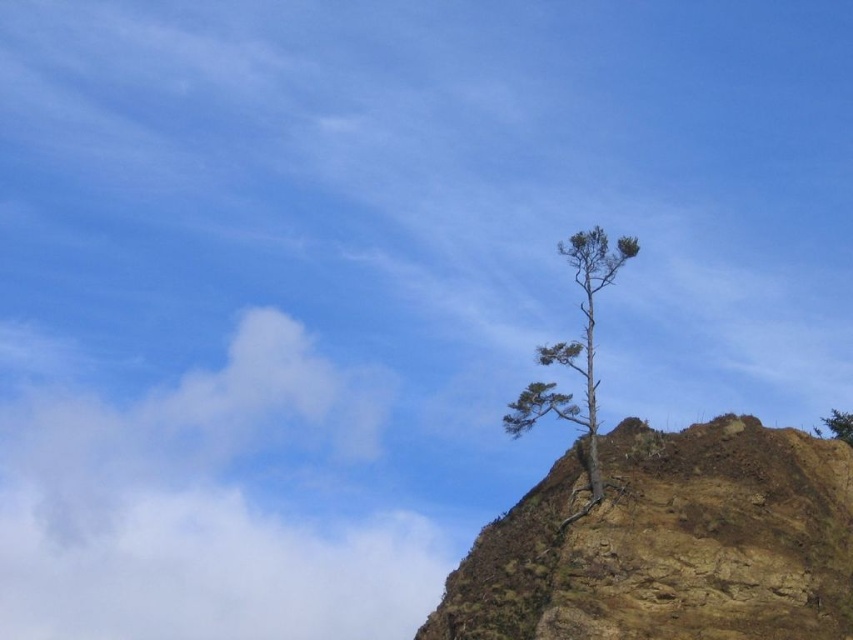
You are a hiker standing at the base of the cliff and see both the green textured tree at upper right and the green leafy tree at upper right. Which tree is farther away from you?

The green textured tree at upper right is farther away from you than the green leafy tree at upper right by 135.55 feet.

Consider the image. You are an environmental scientist assessing the stability of the brown rocky cliff at upper right and the green textured tree at upper right. Which object occupies more horizontal space in the scene?

The brown rocky cliff at upper right might be wider than the green textured tree at upper right, so it likely occupies more horizontal space.